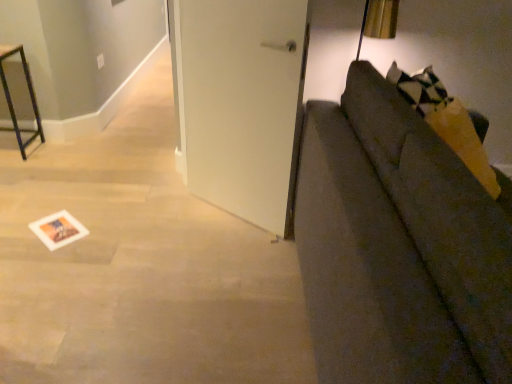
Where is `free point behind white paper postcard at lower left`? The image size is (512, 384). free point behind white paper postcard at lower left is located at coordinates click(76, 207).